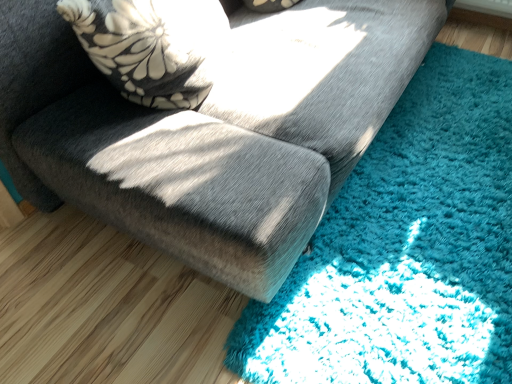
Describe the element at coordinates (212, 130) in the screenshot. The image size is (512, 384). I see `velvet gray couch at center` at that location.

I want to click on velvet gray couch at center, so click(x=212, y=130).

Find the location of `velvet gray couch at center`. velvet gray couch at center is located at coordinates (212, 130).